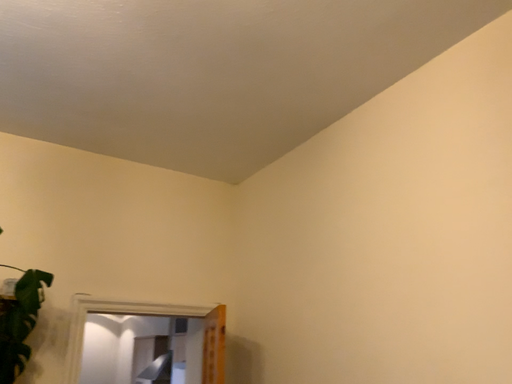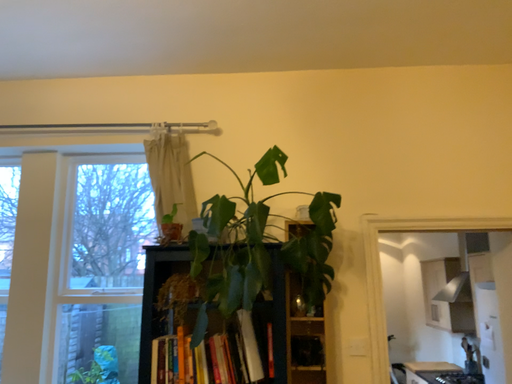
Question: Which way did the camera rotate in the video?

Choices:
 (A) rotated downward
 (B) rotated upward

Answer: (A)